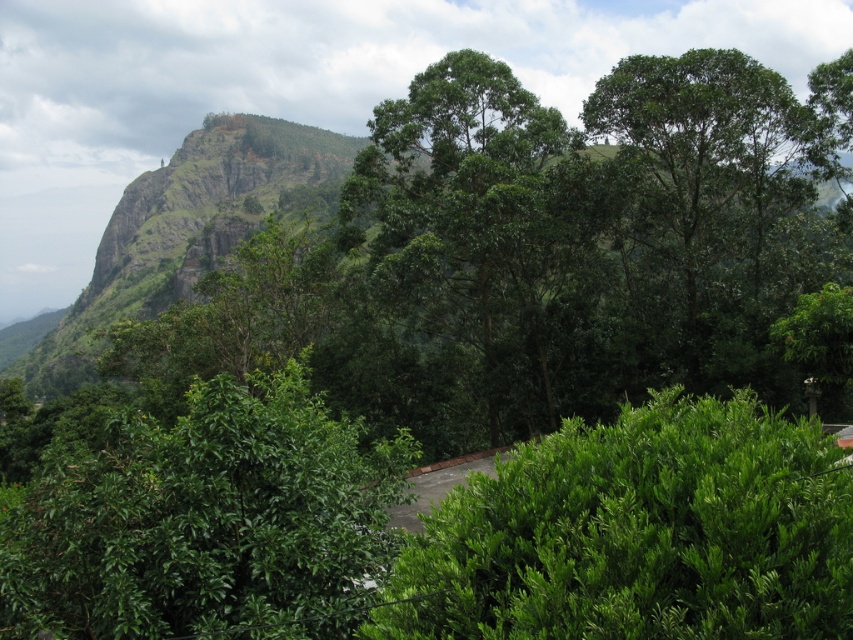
Question: Which of the following is the closest to the observer?

Choices:
 (A) (502, 120)
 (B) (740, 324)

Answer: (B)

Question: From the image, what is the correct spatial relationship of green leafy tree at center in relation to green leafy tree at upper right?

Choices:
 (A) left
 (B) right

Answer: (A)

Question: Is the position of green leafy tree at center less distant than that of green leafy tree at upper right?

Choices:
 (A) yes
 (B) no

Answer: (B)

Question: Among these points, which one is farthest from the camera?

Choices:
 (A) (488, 280)
 (B) (723, 308)

Answer: (A)

Question: Is green leafy tree at center thinner than green leafy tree at upper right?

Choices:
 (A) yes
 (B) no

Answer: (B)